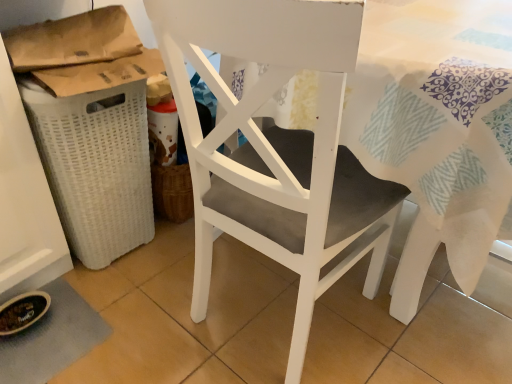
Describe the element at coordinates (95, 166) in the screenshot. The height and width of the screenshot is (384, 512). I see `white woven laundry basket at left` at that location.

Find the location of `white woven laundry basket at left`. white woven laundry basket at left is located at coordinates (95, 166).

What is the approximate height of white matte chair at center?

The height of white matte chair at center is 35.54 inches.

Describe the element at coordinates (277, 147) in the screenshot. I see `white matte chair at center` at that location.

This screenshot has height=384, width=512. I want to click on white matte chair at center, so click(x=277, y=147).

At what (x,y) coordinates should I click in order to perform the action: click on white woven laundry basket at left. Please return your answer as a coordinate pair (x, y). The width and height of the screenshot is (512, 384). Looking at the image, I should click on (95, 166).

Which object is positioned more to the right, white woven laundry basket at left or white matte chair at center?

From the viewer's perspective, white matte chair at center appears more on the right side.

Is white woven laundry basket at left positioned behind white matte chair at center?

Yes, white woven laundry basket at left is further from the camera.

Considering the positions of points (109, 189) and (228, 122), is point (109, 189) farther from camera compared to point (228, 122)?

That is True.

From the image's perspective, which one is positioned higher, white woven laundry basket at left or white matte chair at center?

white woven laundry basket at left is shown above in the image.

From a real-world perspective, is white woven laundry basket at left under white matte chair at center?

Yes, from a real-world perspective, white woven laundry basket at left is beneath white matte chair at center.

Considering the sizes of white woven laundry basket at left and white matte chair at center in the image, is white woven laundry basket at left wider or thinner than white matte chair at center?

Clearly, white woven laundry basket at left has less width compared to white matte chair at center.

Considering the sizes of objects white woven laundry basket at left and white matte chair at center in the image provided, who is taller, white woven laundry basket at left or white matte chair at center?

Standing taller between the two is white matte chair at center.

Based on their sizes in the image, would you say white woven laundry basket at left is bigger or smaller than white matte chair at center?

In the image, white woven laundry basket at left appears to be smaller than white matte chair at center.

Is white woven laundry basket at left inside the boundaries of white matte chair at center, or outside?

white woven laundry basket at left lies outside white matte chair at center.

Is white woven laundry basket at left beside white matte chair at center?

No.

Is white matte chair at center at the back of white woven laundry basket at left?

white woven laundry basket at left does not have its back to white matte chair at center.

How much distance is there between white woven laundry basket at left and white matte chair at center?

white woven laundry basket at left is 17.85 inches from white matte chair at center.

Where is `laundry basket above the white matte chair at center (from the image's perspective)`? laundry basket above the white matte chair at center (from the image's perspective) is located at coordinates (95, 166).

Which object is positioned more to the right, white matte chair at center or white woven laundry basket at left?

Positioned to the right is white matte chair at center.

In the image, is white matte chair at center positioned in front of or behind white woven laundry basket at left?

Clearly, white matte chair at center is in front of white woven laundry basket at left.

Considering the positions of point (324, 263) and point (113, 161), is point (324, 263) closer or farther from the camera than point (113, 161)?

Clearly, point (324, 263) is closer to the camera than point (113, 161).

In the scene shown: From the image's perspective, is white matte chair at center positioned above or below white woven laundry basket at left?

From the image's perspective, white matte chair at center appears below white woven laundry basket at left.

From a real-world perspective, is white matte chair at center physically located above or below white woven laundry basket at left?

In terms of real-world spatial position, white matte chair at center is above white woven laundry basket at left.

Which of these two, white matte chair at center or white woven laundry basket at left, is thinner?

Thinner between the two is white woven laundry basket at left.

Between white matte chair at center and white woven laundry basket at left, which one has more height?

Standing taller between the two is white matte chair at center.

Considering the sizes of objects white matte chair at center and white woven laundry basket at left in the image provided, who is smaller, white matte chair at center or white woven laundry basket at left?

Smaller between the two is white woven laundry basket at left.

Is white matte chair at center completely or partially outside of white woven laundry basket at left?

white matte chair at center lies outside white woven laundry basket at left's area.

Is white matte chair at center positioned far away from white woven laundry basket at left?

white matte chair at center is actually quite close to white woven laundry basket at left.

Is white matte chair at center turned away from white woven laundry basket at left?

No, white matte chair at center is not facing the opposite direction of white woven laundry basket at left.

Find the location of a particular element. This screenshot has width=512, height=384. laundry basket on the left side of white matte chair at center is located at coordinates (95, 166).

I want to click on chair in front of the white woven laundry basket at left, so click(x=277, y=147).

You are a GUI agent. You are given a task and a screenshot of the screen. Output one action in this format:
    pyautogui.click(x=<x>, y=<y>)
    Task: Click on the laundry basket that appears behind the white matte chair at center
    Image resolution: width=512 pixels, height=384 pixels.
    Given the screenshot: What is the action you would take?
    pyautogui.click(x=95, y=166)